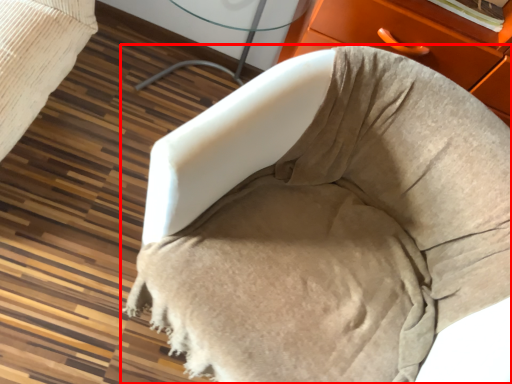
Question: From the image's perspective, what is the correct spatial positioning of furniture (annotated by the red box) in reference to table?

Choices:
 (A) below
 (B) above

Answer: (A)